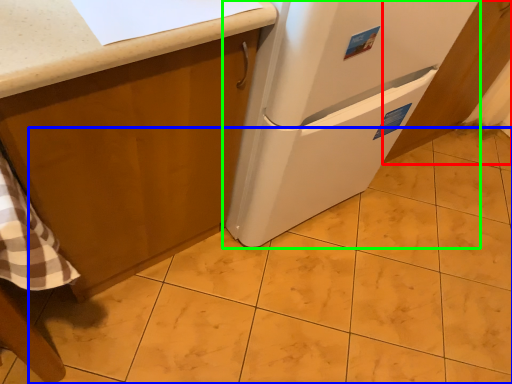
Question: Estimate the real-world distances between objects in this image. Which object is closer to cabinetry (highlighted by a red box), tile (highlighted by a blue box) or refrigerator (highlighted by a green box)?

Choices:
 (A) tile
 (B) refrigerator

Answer: (B)